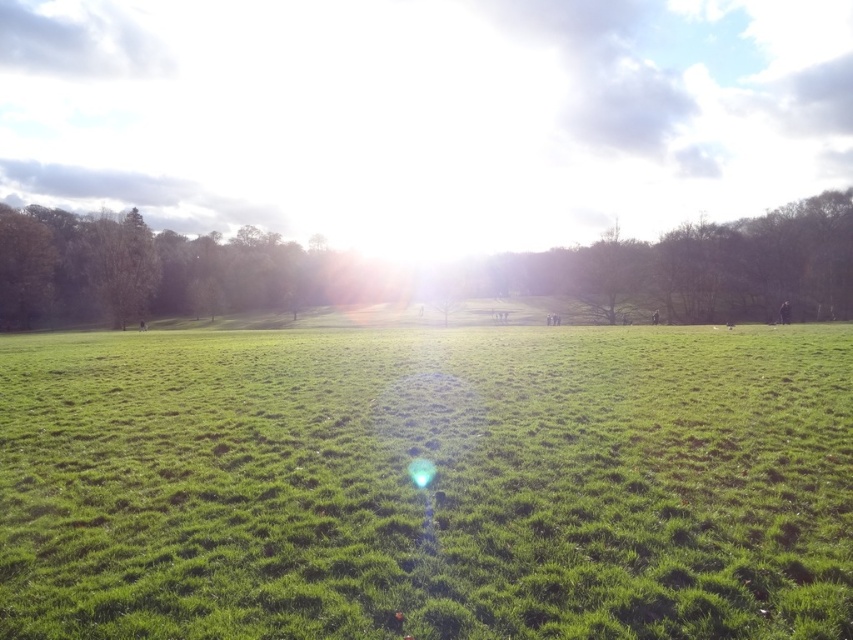
You are standing at the edge of the grassy area and want to walk to the green leafy tree at center. However, there is a green leafy tree at left in your path. Which tree will you pass first?

The green leafy tree at left is shorter than the green leafy tree at center, so you will pass the green leafy tree at left first before reaching the taller green leafy tree at center.

From the picture: You are a landscape architect designing a garden and want to place a bench between the green leafy tree at left and the green leafy tree at center. Which tree should the bench be closer to to ensure it doesn

The bench should be closer to the green leafy tree at center because the green leafy tree at left is wider, so placing the bench closer to the narrower tree would provide more balanced spacing between them.

You are standing in the middle of the green grass at center and want to walk towards the green leafy tree at left. Which direction should you face to walk directly towards it?

You should face to the left because the green leafy tree at left is to the left of the green grass at center.